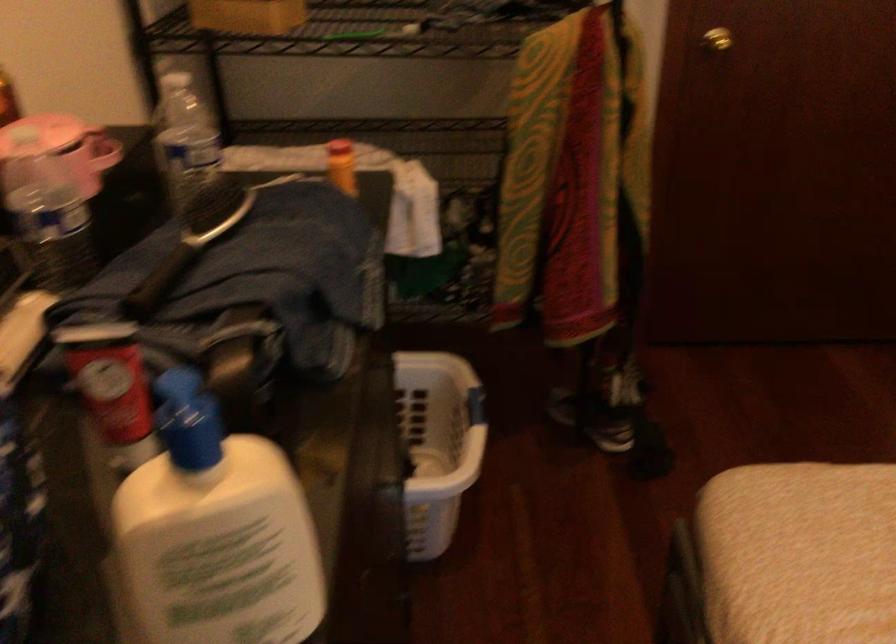
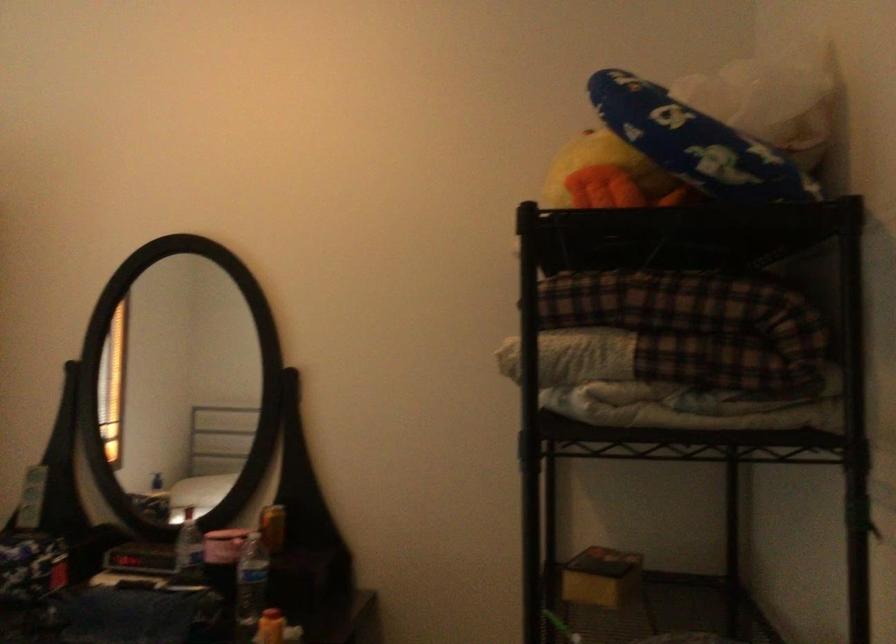
Find the pixel in the second image that matches pixel 346 163 in the first image.

(270, 627)